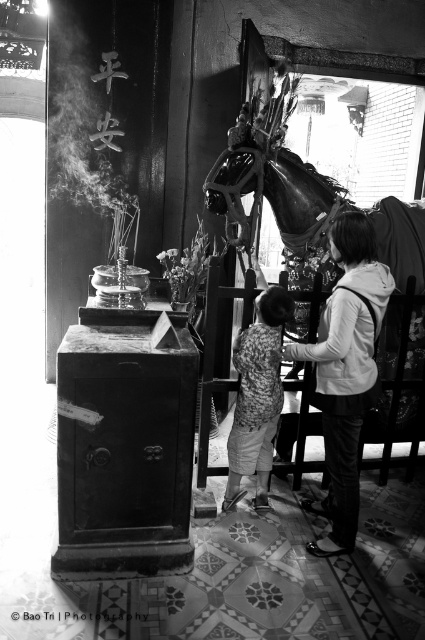
Question: Where is matte gray hoodie at center located in relation to printed fabric shirt at center in the image?

Choices:
 (A) left
 (B) right

Answer: (B)

Question: Is matte gray hoodie at center to the left of printed fabric shirt at center from the viewer's perspective?

Choices:
 (A) no
 (B) yes

Answer: (A)

Question: Which point is farther from the camera taking this photo?

Choices:
 (A) (238, 356)
 (B) (325, 448)

Answer: (A)

Question: Is matte gray hoodie at center bigger than printed fabric shirt at center?

Choices:
 (A) yes
 (B) no

Answer: (A)

Question: Among these objects, which one is nearest to the camera?

Choices:
 (A) printed fabric shirt at center
 (B) matte gray hoodie at center

Answer: (B)

Question: Which object appears closest to the camera in this image?

Choices:
 (A) matte gray hoodie at center
 (B) printed fabric shirt at center

Answer: (A)